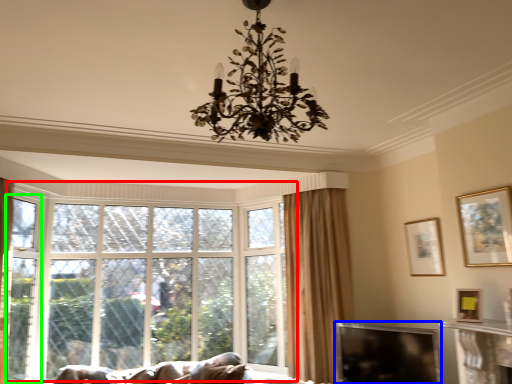
Question: Which object is the farthest from window (highlighted by a red box)? Choose among these: window screen (highlighted by a blue box) or screen door (highlighted by a green box).

Choices:
 (A) window screen
 (B) screen door

Answer: (A)